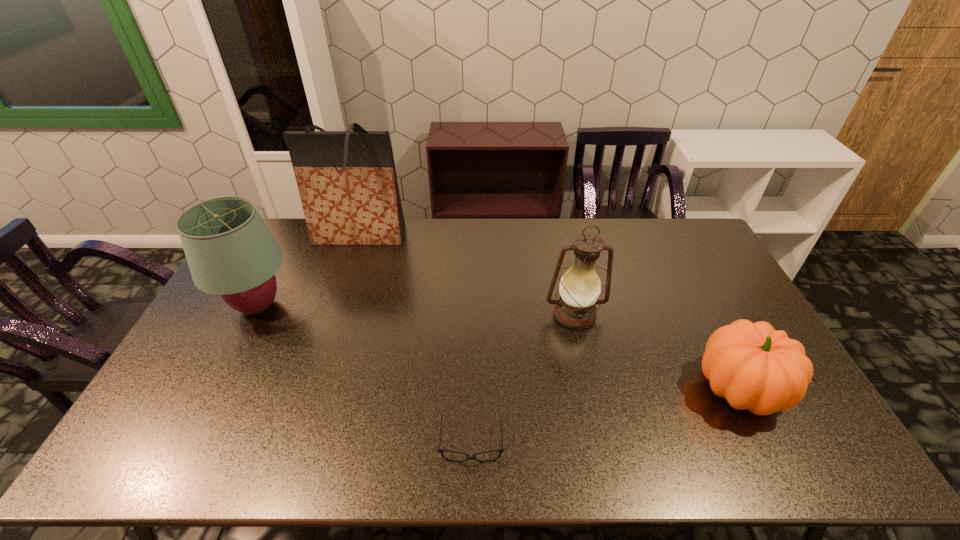
I want to click on free space located on the left of the fourth object from left to right, so click(x=437, y=315).

The height and width of the screenshot is (540, 960). Find the location of `vacant space located 0.240m on the left of the pumpkin`. vacant space located 0.240m on the left of the pumpkin is located at coordinates (607, 389).

Find the location of a particular element. This screenshot has width=960, height=540. object at the far edge is located at coordinates (347, 181).

Where is `object present at the near edge`? The width and height of the screenshot is (960, 540). object present at the near edge is located at coordinates (441, 451).

Find the location of `object that is at the left edge`. object that is at the left edge is located at coordinates (230, 252).

Identify the location of object that is at the right edge. The image size is (960, 540). (755, 367).

Image resolution: width=960 pixels, height=540 pixels. In the image, there is a desktop. Find the location of `free region at the far edge`. free region at the far edge is located at coordinates (540, 251).

Identify the location of vacant area at the near edge of the desktop. (252, 451).

What are the coordinates of `free space between the shopping bag and the oil lamp` in the screenshot? It's located at (467, 275).

Where is `free area in between the rightmost object and the lampshade`? free area in between the rightmost object and the lampshade is located at coordinates (499, 348).